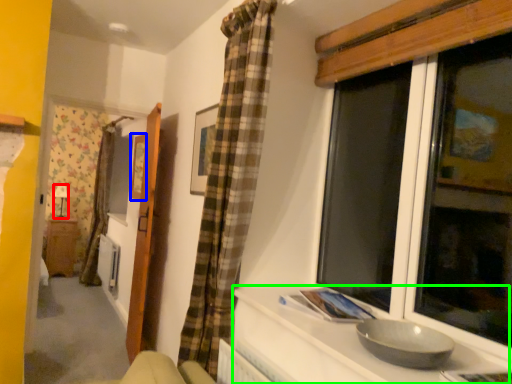
Question: Which object is the closest to the lamp (highlighted by a red box)? Choose among these: picture frame (highlighted by a blue box) or counter top (highlighted by a green box).

Choices:
 (A) picture frame
 (B) counter top

Answer: (A)